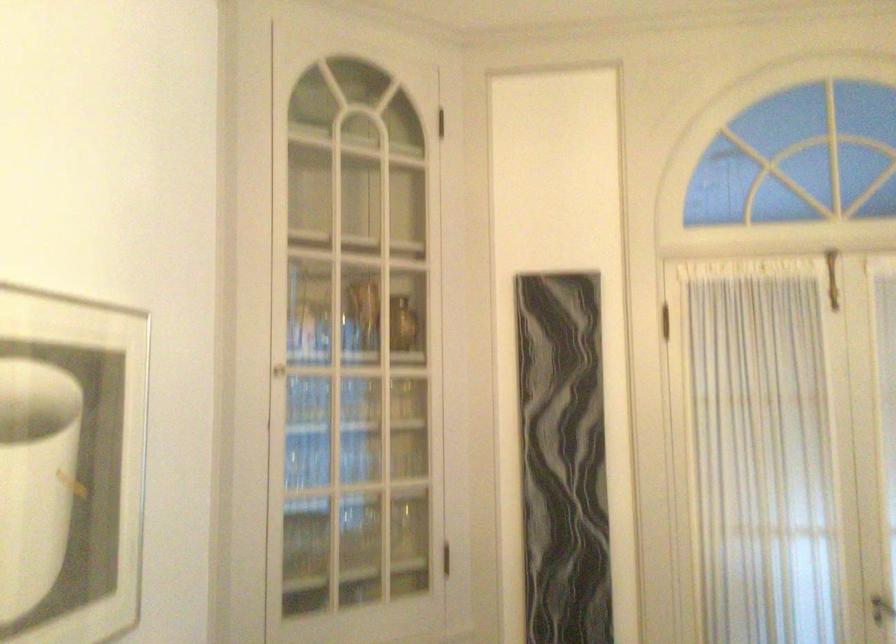
Describe the element at coordinates (882, 609) in the screenshot. I see `a door handle` at that location.